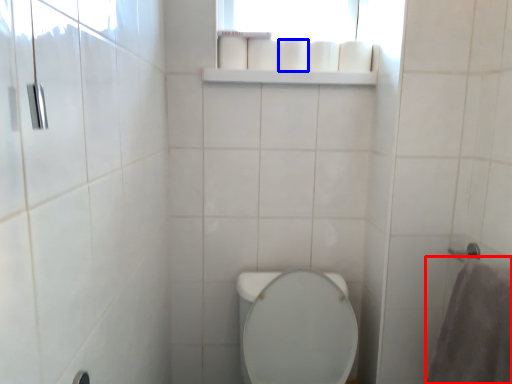
Question: Which object is further to the camera taking this photo, bath towel (highlighted by a red box) or toilet paper (highlighted by a blue box)?

Choices:
 (A) bath towel
 (B) toilet paper

Answer: (B)